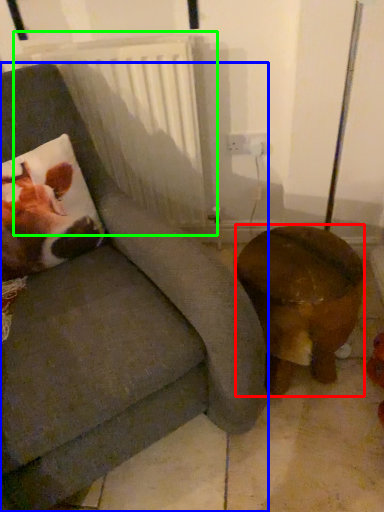
Question: Considering the real-world distances, which object is farthest from furniture (highlighted by a red box)? chair (highlighted by a blue box) or radiator (highlighted by a green box)?

Choices:
 (A) chair
 (B) radiator

Answer: (B)